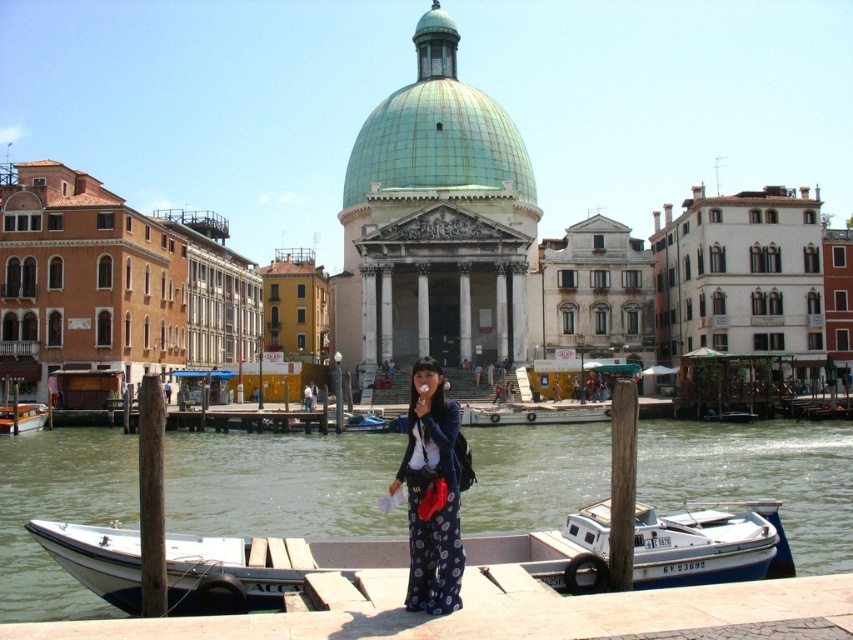
You are a tourist in Venice and want to take a boat ride. You see a white matte boat at lower center and a smooth concrete dock at lower center. Which one is bigger in size?

The white matte boat at lower center is larger in size than the smooth concrete dock at lower center.

You are a tourist in Venice, standing at the dock where the woman is. You want to take a photo of the green dome of the church behind you. However, there are two points marked in the image. The first point is at coordinates point (170,612), and the second is at point (440,380). Which point should you stand behind to ensure the green dome is visible in your photo?

You should stand behind point (440,380) because point (170,612) is in front of it, which would block the view of the green dome behind.